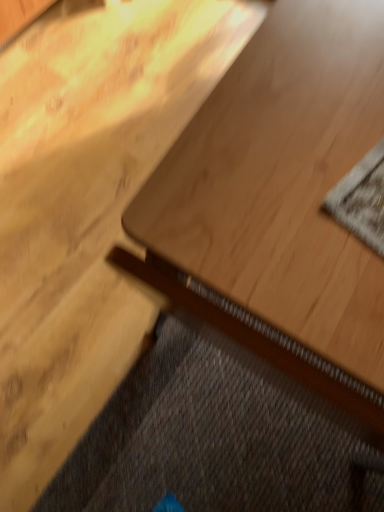
Question: From the image's perspective, is textured gray mat at upper right located above or below light wood table at center?

Choices:
 (A) above
 (B) below

Answer: (A)

Question: Is textured gray mat at upper right in front of or behind light wood table at center in the image?

Choices:
 (A) behind
 (B) front

Answer: (A)

Question: Which is farther from the dark gray textured doormat at lower left?

Choices:
 (A) light wood table at center
 (B) textured gray mat at upper right

Answer: (B)

Question: Which object is positioned closest to the light wood table at center?

Choices:
 (A) dark gray textured doormat at lower left
 (B) textured gray mat at upper right

Answer: (B)